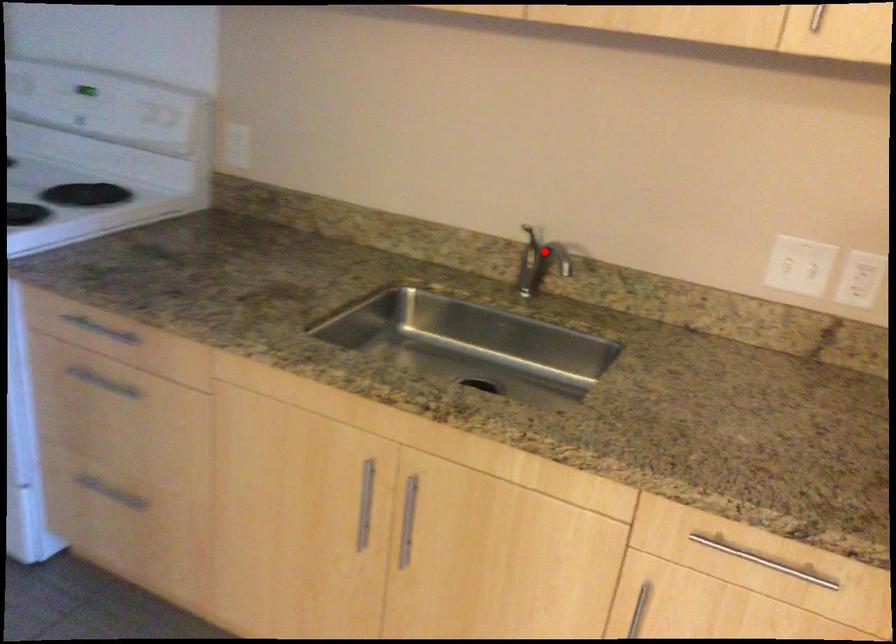
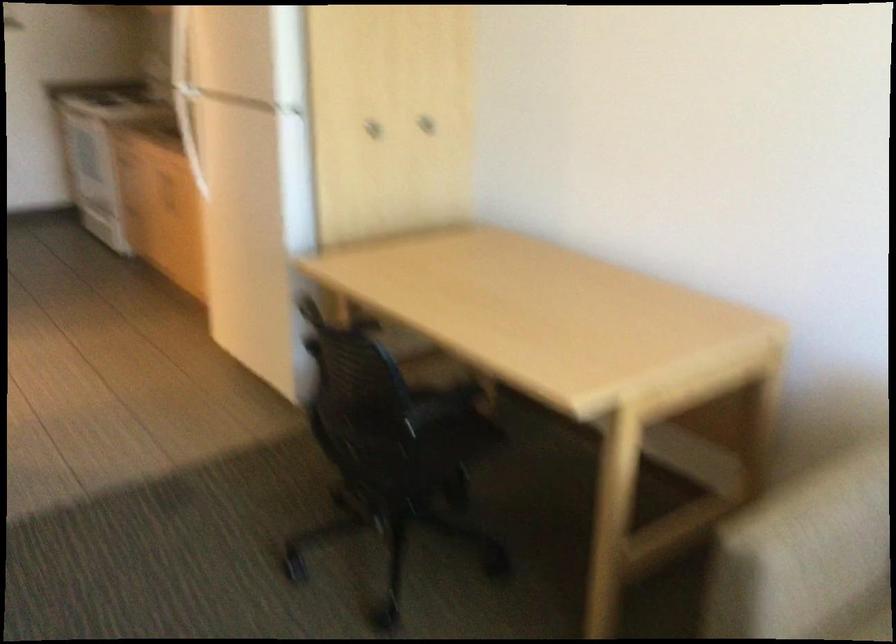
Question: I am providing you with two images of the same scene from different viewpoints. A red point is marked on the first image. Can you still see the location of the red point in image 2?

Choices:
 (A) Yes
 (B) No

Answer: (B)